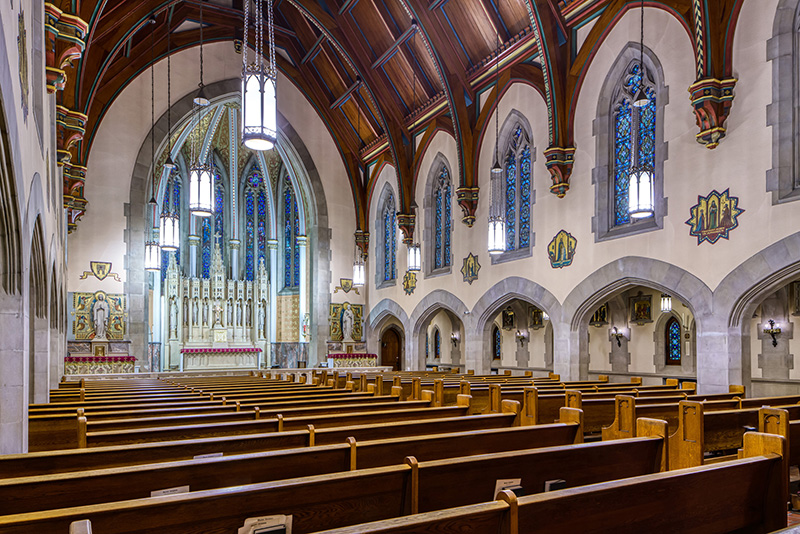
The width and height of the screenshot is (800, 534). In order to click on crucifix in this screenshot , I will do `click(266, 258)`, `click(217, 233)`.